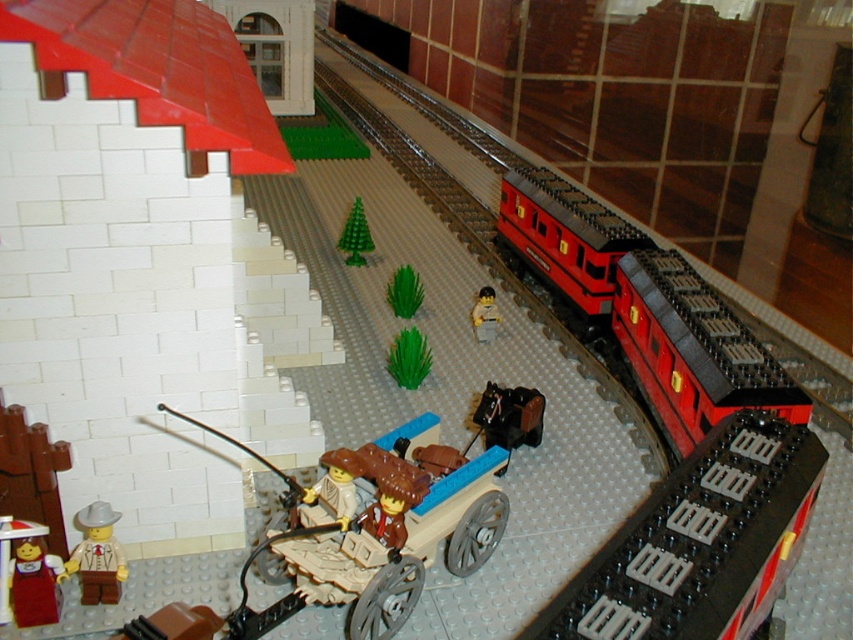
Question: Is black plastic horse at center closer to the viewer compared to green matte plant at center?

Choices:
 (A) yes
 (B) no

Answer: (A)

Question: Is smooth plastic train at center positioned before smooth red shirt at lower left?

Choices:
 (A) no
 (B) yes

Answer: (A)

Question: Which of the following is the closest to the observer?

Choices:
 (A) (120, 554)
 (B) (476, 316)
 (C) (520, 412)

Answer: (A)

Question: Which point is closer to the camera?

Choices:
 (A) green plastic plant at center
 (B) green plastic tree at center

Answer: (A)

Question: Where is smooth red shirt at lower left located in relation to green plastic tree at center in the image?

Choices:
 (A) right
 (B) left

Answer: (B)

Question: Among these points, which one is farthest from the camera?

Choices:
 (A) (48, 573)
 (B) (96, 506)
 (C) (404, 269)
 (D) (486, 294)

Answer: (C)